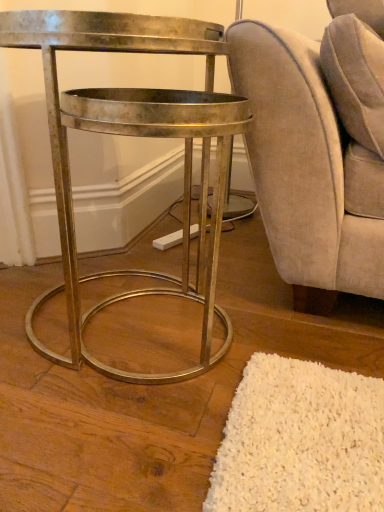
In order to face metallic gold table at left, should I rotate leftwards or rightwards?

You should look left and rotate roughly 10.443 degrees.

What do you see at coordinates (136, 136) in the screenshot? The image size is (384, 512). I see `metallic gold table at left` at bounding box center [136, 136].

Where is `metallic gold table at left`? metallic gold table at left is located at coordinates (136, 136).

Measure the distance between metallic gold table at left and camera.

A distance of 25.54 inches exists between metallic gold table at left and camera.

Identify the location of metallic gold table at left. (136, 136).